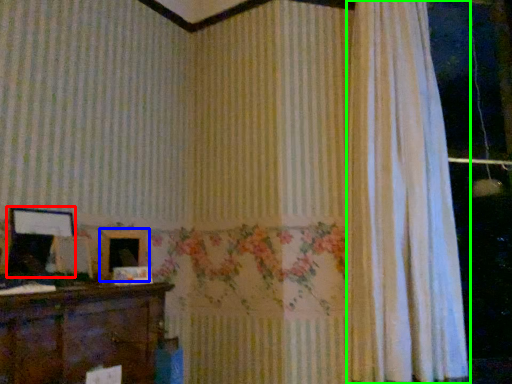
Question: Considering the real-world distances, which object is closest to picture frame (highlighted by a red box)? picture frame (highlighted by a blue box) or curtain (highlighted by a green box).

Choices:
 (A) picture frame
 (B) curtain

Answer: (A)